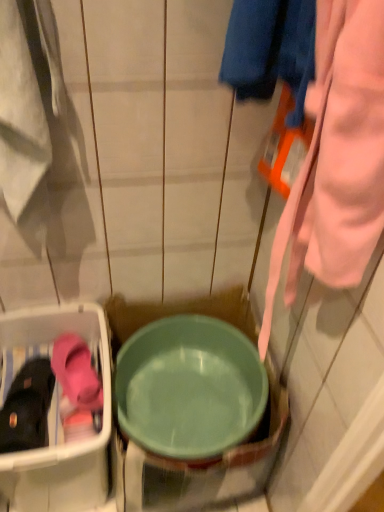
Question: Is matte pink slipper at lower left at the right side of green plastic basin at center?

Choices:
 (A) yes
 (B) no

Answer: (B)

Question: Can you confirm if matte pink slipper at lower left is thinner than green plastic basin at center?

Choices:
 (A) yes
 (B) no

Answer: (A)

Question: Is matte pink slipper at lower left oriented towards green plastic basin at center?

Choices:
 (A) yes
 (B) no

Answer: (B)

Question: Is matte pink slipper at lower left far away from green plastic basin at center?

Choices:
 (A) yes
 (B) no

Answer: (B)

Question: From the image's perspective, does matte pink slipper at lower left appear lower than green plastic basin at center?

Choices:
 (A) no
 (B) yes

Answer: (A)

Question: Is matte pink slipper at lower left taller than green plastic basin at center?

Choices:
 (A) yes
 (B) no

Answer: (B)

Question: From a real-world perspective, is green plastic basin at center positioned under matte pink slipper at lower left based on gravity?

Choices:
 (A) yes
 (B) no

Answer: (A)

Question: Is the depth of green plastic basin at center less than that of matte pink slipper at lower left?

Choices:
 (A) yes
 (B) no

Answer: (A)

Question: Are green plastic basin at center and matte pink slipper at lower left located far from each other?

Choices:
 (A) yes
 (B) no

Answer: (B)

Question: Is green plastic basin at center oriented away from matte pink slipper at lower left?

Choices:
 (A) no
 (B) yes

Answer: (A)

Question: Can you confirm if green plastic basin at center is positioned to the left of matte pink slipper at lower left?

Choices:
 (A) no
 (B) yes

Answer: (A)

Question: Does green plastic basin at center have a lesser width compared to matte pink slipper at lower left?

Choices:
 (A) yes
 (B) no

Answer: (B)

Question: Is matte pink slipper at lower left wider or thinner than green plastic basin at center?

Choices:
 (A) thin
 (B) wide

Answer: (A)